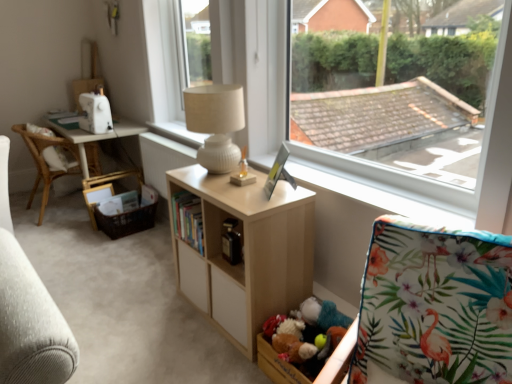
Question: From the image's perspective, is light wood shelf at center under floral fabric rocking chair at lower right?

Choices:
 (A) yes
 (B) no

Answer: (B)

Question: Is light wood shelf at center touching floral fabric rocking chair at lower right?

Choices:
 (A) no
 (B) yes

Answer: (A)

Question: Can you confirm if light wood shelf at center is shorter than floral fabric rocking chair at lower right?

Choices:
 (A) no
 (B) yes

Answer: (B)

Question: Is light wood shelf at center closer to the viewer compared to floral fabric rocking chair at lower right?

Choices:
 (A) yes
 (B) no

Answer: (B)

Question: Is light wood shelf at center not close to floral fabric rocking chair at lower right?

Choices:
 (A) no
 (B) yes

Answer: (A)

Question: Does point (182, 127) appear closer or farther from the camera than point (115, 203)?

Choices:
 (A) closer
 (B) farther

Answer: (B)

Question: From a real-world perspective, is white textured lamp at upper center above or below brown woven picnic basket at lower left?

Choices:
 (A) below
 (B) above

Answer: (B)

Question: Would you say white textured lamp at upper center is inside or outside brown woven picnic basket at lower left?

Choices:
 (A) inside
 (B) outside

Answer: (B)

Question: In terms of height, does white textured lamp at upper center look taller or shorter compared to brown woven picnic basket at lower left?

Choices:
 (A) tall
 (B) short

Answer: (B)

Question: From a real-world perspective, is transparent glass window at upper center above or below hardcover books at center?

Choices:
 (A) above
 (B) below

Answer: (A)

Question: Considering their positions, is transparent glass window at upper center located in front of or behind hardcover books at center?

Choices:
 (A) behind
 (B) front

Answer: (B)

Question: Do you think transparent glass window at upper center is within hardcover books at center, or outside of it?

Choices:
 (A) inside
 (B) outside

Answer: (B)

Question: Considering the positions of transparent glass window at upper center and hardcover books at center in the image, is transparent glass window at upper center wider or thinner than hardcover books at center?

Choices:
 (A) thin
 (B) wide

Answer: (B)

Question: Considering the positions of white plastic window frame at upper center and white textured lamp at upper center in the image, is white plastic window frame at upper center bigger or smaller than white textured lamp at upper center?

Choices:
 (A) big
 (B) small

Answer: (A)

Question: From the image's perspective, relative to white textured lamp at upper center, is white plastic window frame at upper center above or below?

Choices:
 (A) above
 (B) below

Answer: (A)